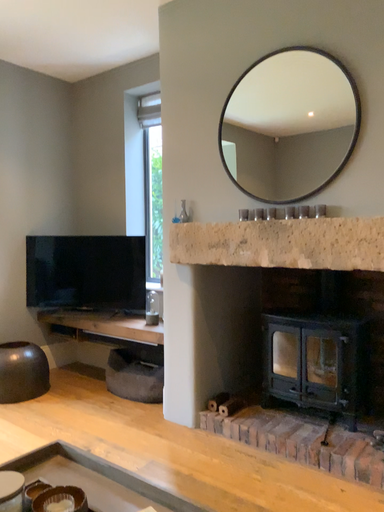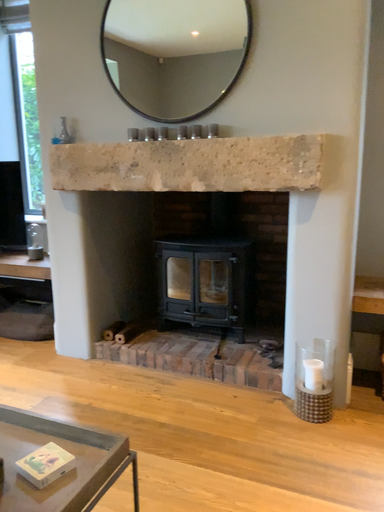
Question: How did the camera likely rotate when shooting the video?

Choices:
 (A) rotated left
 (B) rotated right

Answer: (B)